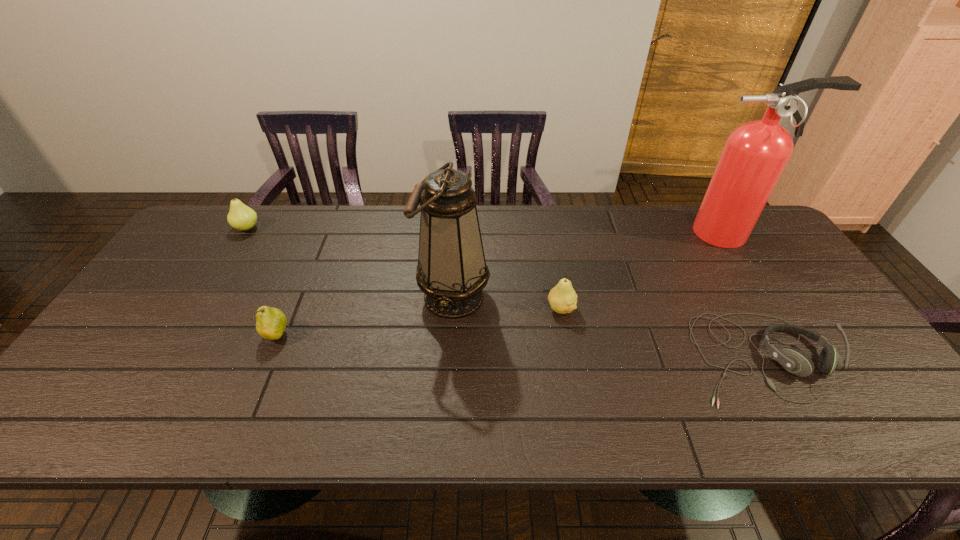
Where is `fire extinguisher that is positioned at the right edge`? This screenshot has width=960, height=540. fire extinguisher that is positioned at the right edge is located at coordinates (755, 154).

Image resolution: width=960 pixels, height=540 pixels. I want to click on headset located in the right edge section of the desktop, so click(x=794, y=361).

Find the location of a particular element. This screenshot has height=540, width=960. object that is positioned at the far left corner is located at coordinates (241, 217).

The image size is (960, 540). In order to click on object that is at the far right corner in this screenshot , I will do `click(755, 154)`.

This screenshot has height=540, width=960. Find the location of `object located at the near right corner`. object located at the near right corner is located at coordinates (794, 361).

Identify the location of vacant area at the far edge of the desktop. [x=591, y=230].

The image size is (960, 540). In order to click on blank area at the near edge in this screenshot , I will do `click(825, 437)`.

Find the location of `vacant space at the right edge`. vacant space at the right edge is located at coordinates (875, 383).

Locate an element on the screen. The width and height of the screenshot is (960, 540). empty space that is in between the shortest object and the rightmost pear is located at coordinates (660, 333).

Identify the location of free space between the farthest pear and the third object from left to right. (350, 262).